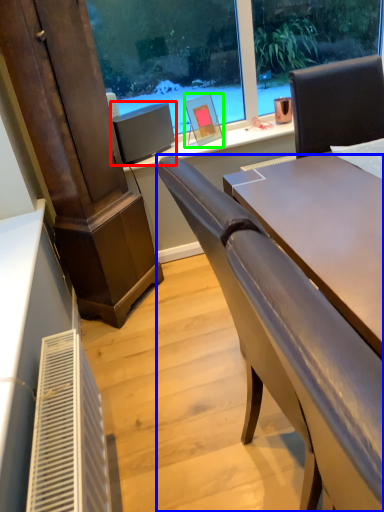
Question: Considering the real-world distances, which object is farthest from computer monitor (highlighted by a red box)? chair (highlighted by a blue box) or picture frame (highlighted by a green box)?

Choices:
 (A) chair
 (B) picture frame

Answer: (A)